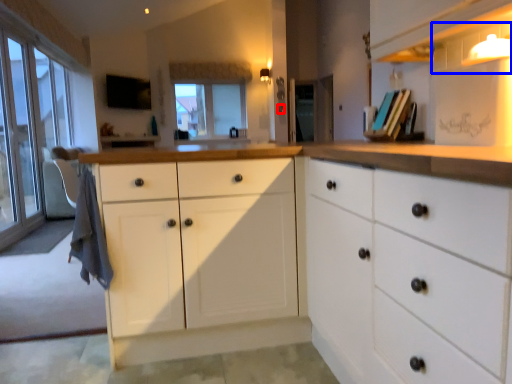
Question: Which point is closer to the camera, knob (highlighted by a red box) or shelf (highlighted by a blue box)?

Choices:
 (A) knob
 (B) shelf

Answer: (B)